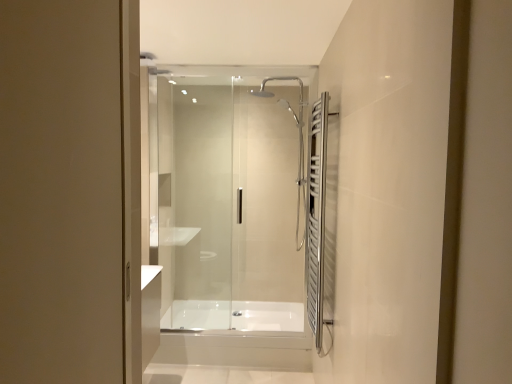
Question: Considering the positions of point (206, 89) and point (279, 309), is point (206, 89) closer or farther from the camera than point (279, 309)?

Choices:
 (A) closer
 (B) farther

Answer: (A)

Question: From a real-world perspective, relative to white glossy bathtub at center, is transparent glass shower door at center vertically above or below?

Choices:
 (A) below
 (B) above

Answer: (B)

Question: Based on their relative distances, which object is farther from the white glossy bathtub at center?

Choices:
 (A) transparent glass shower door at center
 (B) satin nickel towel rack at right

Answer: (B)

Question: Considering the real-world distances, which object is closest to the white glossy bathtub at center?

Choices:
 (A) satin nickel towel rack at right
 (B) transparent glass shower door at center

Answer: (B)